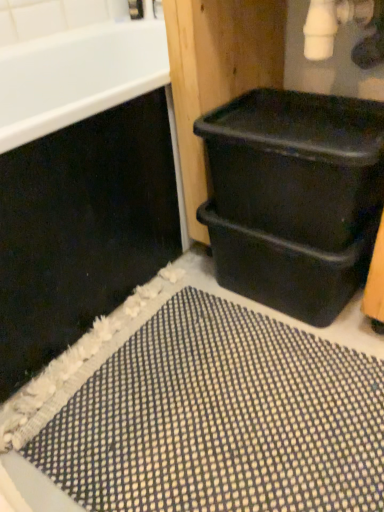
Question: Considering the relative positions of black textured bath mat at lower right and black plastic tub at right in the image provided, is black textured bath mat at lower right to the left or to the right of black plastic tub at right?

Choices:
 (A) left
 (B) right

Answer: (B)

Question: Is black textured bath mat at lower right wider or thinner than black plastic tub at right?

Choices:
 (A) thin
 (B) wide

Answer: (A)

Question: Which is farther from the black plastic bin at lower right?

Choices:
 (A) black plastic tub at right
 (B) black plastic bin at right
 (C) black textured bath mat at lower right

Answer: (A)

Question: Estimate the real-world distances between objects in this image. Which object is farther from the black textured bath mat at lower right?

Choices:
 (A) black plastic tub at right
 (B) black plastic bin at lower right
 (C) black plastic bin at right

Answer: (A)